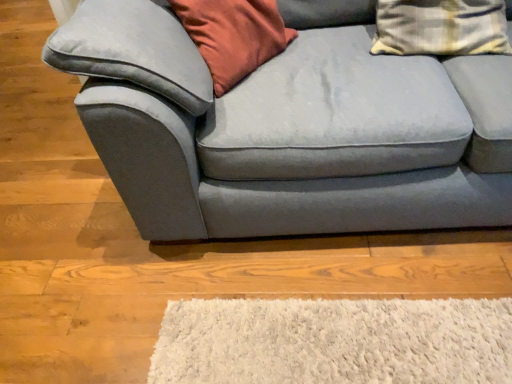
Question: Would you say suede gray couch at center is to the left or to the right of plaid fabric pillow at upper right in the picture?

Choices:
 (A) right
 (B) left

Answer: (B)

Question: Choose the correct answer: Is suede gray couch at center inside plaid fabric pillow at upper right or outside it?

Choices:
 (A) inside
 (B) outside

Answer: (B)

Question: Is suede gray couch at center bigger or smaller than plaid fabric pillow at upper right?

Choices:
 (A) big
 (B) small

Answer: (A)

Question: Considering their positions, is plaid fabric pillow at upper right located in front of or behind suede gray couch at center?

Choices:
 (A) front
 (B) behind

Answer: (B)

Question: Considering the positions of plaid fabric pillow at upper right and suede gray couch at center in the image, is plaid fabric pillow at upper right taller or shorter than suede gray couch at center?

Choices:
 (A) short
 (B) tall

Answer: (A)

Question: Looking at their shapes, would you say plaid fabric pillow at upper right is wider or thinner than suede gray couch at center?

Choices:
 (A) thin
 (B) wide

Answer: (A)

Question: Would you say plaid fabric pillow at upper right is to the left or to the right of suede gray couch at center in the picture?

Choices:
 (A) left
 (B) right

Answer: (B)